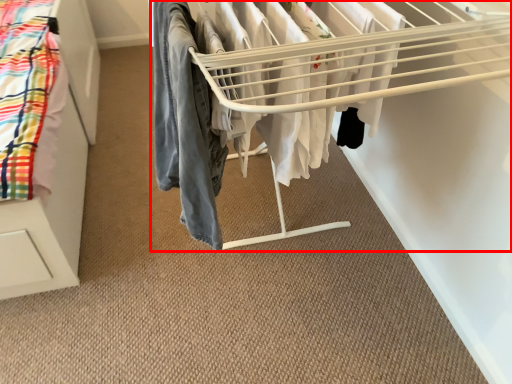
Question: From the image's perspective, where is bunk bed (annotated by the red box) located relative to clothing?

Choices:
 (A) above
 (B) below

Answer: (A)